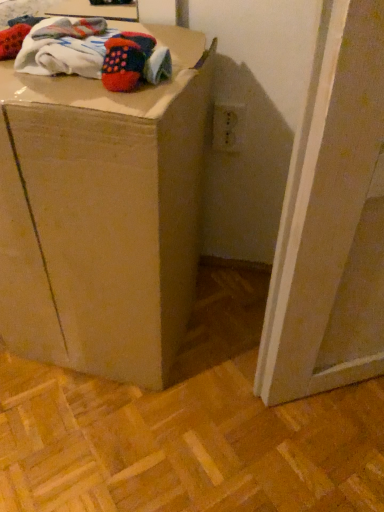
The width and height of the screenshot is (384, 512). Describe the element at coordinates (88, 56) in the screenshot. I see `knitted wool socks at upper left` at that location.

This screenshot has height=512, width=384. I want to click on knitted wool socks at upper left, so click(x=88, y=56).

The width and height of the screenshot is (384, 512). What do you see at coordinates (103, 216) in the screenshot?
I see `brown cardboard box at center` at bounding box center [103, 216].

Measure the distance between point (85, 144) and camera.

They are 53.20 centimeters apart.

Find the location of `brown cardboard box at center`. brown cardboard box at center is located at coordinates (103, 216).

This screenshot has width=384, height=512. Find the location of `knitted wool socks at upper left`. knitted wool socks at upper left is located at coordinates (88, 56).

Would you say brown cardboard box at center is to the left or to the right of knitted wool socks at upper left in the picture?

Clearly, brown cardboard box at center is on the left of knitted wool socks at upper left in the image.

Which object is closer to the camera, brown cardboard box at center or knitted wool socks at upper left?

brown cardboard box at center is in front.

Which is closer to the camera, (121, 319) or (31, 50)?

Point (121, 319) appears to be farther away from the viewer than point (31, 50).

From the image's perspective, is brown cardboard box at center positioned above or below knitted wool socks at upper left?

brown cardboard box at center is below knitted wool socks at upper left.

From a real-world perspective, which is physically above, brown cardboard box at center or knitted wool socks at upper left?

knitted wool socks at upper left, from a real-world perspective.

Does brown cardboard box at center have a lesser width compared to knitted wool socks at upper left?

No, brown cardboard box at center is not thinner than knitted wool socks at upper left.

Can you confirm if brown cardboard box at center is taller than knitted wool socks at upper left?

Yes.

Considering the relative sizes of brown cardboard box at center and knitted wool socks at upper left in the image provided, is brown cardboard box at center smaller than knitted wool socks at upper left?

No, brown cardboard box at center is not smaller than knitted wool socks at upper left.

Is brown cardboard box at center inside or outside of knitted wool socks at upper left?

brown cardboard box at center is spatially situated outside knitted wool socks at upper left.

Is brown cardboard box at center far away from knitted wool socks at upper left?

No.

Is brown cardboard box at center oriented towards knitted wool socks at upper left?

No.

How many degrees apart are the facing directions of brown cardboard box at center and knitted wool socks at upper left?

2.89 degrees.

Where is `laundry above the brown cardboard box at center (from the image's perspective)`? laundry above the brown cardboard box at center (from the image's perspective) is located at coordinates (88, 56).

Considering the positions of objects knitted wool socks at upper left and brown cardboard box at center in the image provided, who is more to the right, knitted wool socks at upper left or brown cardboard box at center?

From the viewer's perspective, knitted wool socks at upper left appears more on the right side.

Is knitted wool socks at upper left closer to camera compared to brown cardboard box at center?

No, knitted wool socks at upper left is further to the viewer.

Considering the points (150, 39) and (9, 92), which point is in front, point (150, 39) or point (9, 92)?

The point (9, 92) is closer to the camera.

From the image's perspective, is knitted wool socks at upper left located above or below brown cardboard box at center?

knitted wool socks at upper left is above brown cardboard box at center.

From a real-world perspective, who is located lower, knitted wool socks at upper left or brown cardboard box at center?

From a 3D spatial view, brown cardboard box at center is below.

Which of these two, knitted wool socks at upper left or brown cardboard box at center, is wider?

brown cardboard box at center is wider.

Between knitted wool socks at upper left and brown cardboard box at center, which one has more height?

With more height is brown cardboard box at center.

Which of these two, knitted wool socks at upper left or brown cardboard box at center, is smaller?

Smaller between the two is knitted wool socks at upper left.

Is knitted wool socks at upper left located outside brown cardboard box at center?

No, knitted wool socks at upper left is inside brown cardboard box at center's boundary.

Can you see knitted wool socks at upper left touching brown cardboard box at center?

No.

Is knitted wool socks at upper left aimed at brown cardboard box at center?

No, knitted wool socks at upper left is not turned towards brown cardboard box at center.

How many degrees apart are the facing directions of knitted wool socks at upper left and brown cardboard box at center?

2.89 degrees.

How distant is knitted wool socks at upper left from brown cardboard box at center?

The distance of knitted wool socks at upper left from brown cardboard box at center is 9.37 inches.

The height and width of the screenshot is (512, 384). In the image, there is a brown cardboard box at center. Find the location of `laundry above it (from the image's perspective)`. laundry above it (from the image's perspective) is located at coordinates (88, 56).

The height and width of the screenshot is (512, 384). In order to click on furniture that appears in front of the knitted wool socks at upper left in this screenshot , I will do `click(103, 216)`.

Identify the location of furniture lying below the knitted wool socks at upper left (from the image's perspective). This screenshot has height=512, width=384. (103, 216).